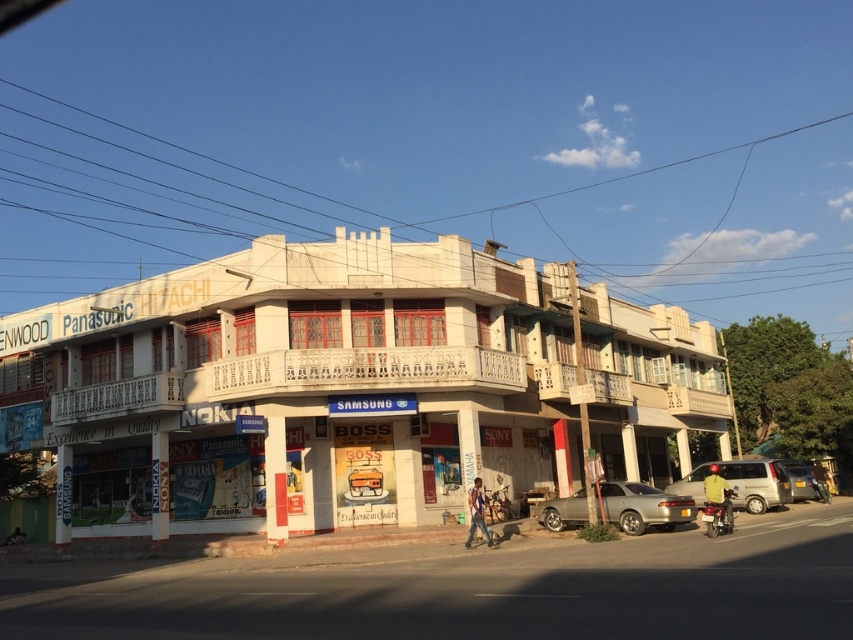
You are a delivery person who needs to park your silver metallic van at right near the black wire at upper center. Can you safely park your van there without blocking the wire?

The black wire at upper center is bigger than the silver metallic van at right, so the van can be parked near it without blocking the wire as the wire is larger in size.

Based on the photo, you are a delivery driver approaching the commercial building. You see a black wire at upper center and a silver metallic van at right. Which object is higher in elevation?

The black wire at upper center is much taller than the silver metallic van at right.